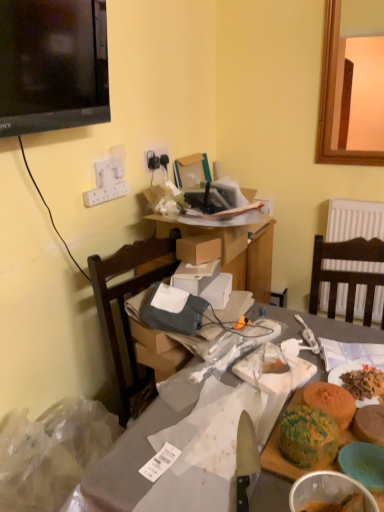
Question: Would you say brown cardboard box at center is to the left or to the right of shiny silver knife at center in the picture?

Choices:
 (A) right
 (B) left

Answer: (B)

Question: Considering the positions of brown cardboard box at center and shiny silver knife at center in the image, is brown cardboard box at center bigger or smaller than shiny silver knife at center?

Choices:
 (A) big
 (B) small

Answer: (A)

Question: Which is farther from the cardboard boxes at center, the 2th table positioned from the bottom?

Choices:
 (A) green textured cake at lower right, which appears as the 2th food when viewed from the right
 (B) brown cardboard box at center
 (C) green textured cake at lower right, the third food when ordered from left to right
 (D) transparent plastic bag at lower left
 (E) black plastic electric outlet at upper center

Answer: (C)

Question: Which is nearer to the cardboard boxes at center, placed as the 1th table when sorted from top to bottom?

Choices:
 (A) green textured cake at lower right, the first food from the right
 (B) matte gray table at center, arranged as the first table when ordered from the bottom
 (C) black plastic electric outlet at upper center
 (D) green textured cake at lower right, which appears as the 2th food when viewed from the left
 (E) brown cardboard box at center

Answer: (E)